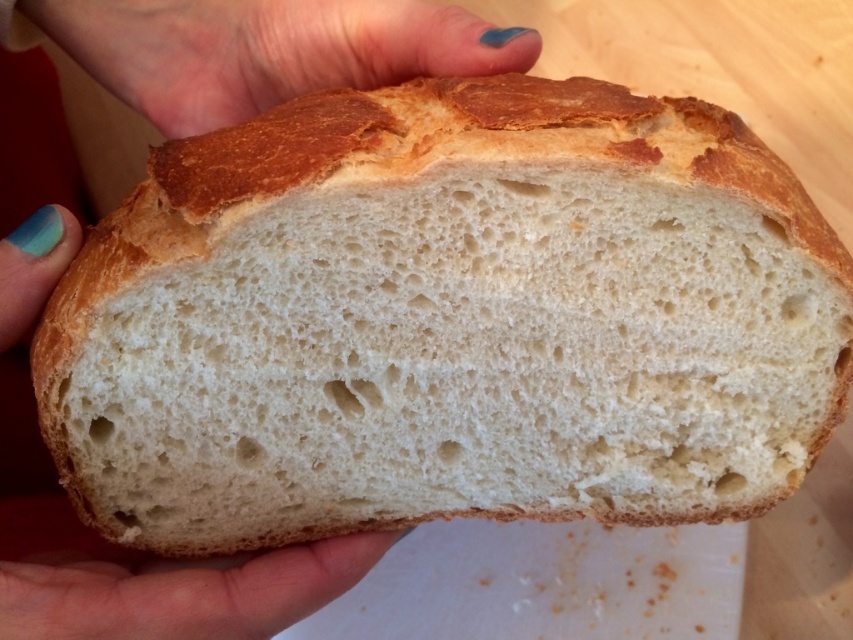
Between golden brown crusty bread at center and teal nail polish at upper center, which one has more height?

golden brown crusty bread at center is taller.

Does golden brown crusty bread at center have a lesser height compared to teal nail polish at upper center?

Incorrect, golden brown crusty bread at center's height does not fall short of teal nail polish at upper center's.

Is point (474, 220) farther from viewer compared to point (125, 16)?

No, (474, 220) is in front of (125, 16).

At what (x,y) coordinates should I click in order to perform the action: click on golden brown crusty bread at center. Please return your answer as a coordinate pair (x, y). Image resolution: width=853 pixels, height=640 pixels. Looking at the image, I should click on (445, 320).

Between golden brown crusty bread at center and teal matte nail polish at upper left, which one has less height?

teal matte nail polish at upper left is shorter.

This screenshot has height=640, width=853. Identify the location of golden brown crusty bread at center. (445, 320).

Where is `golden brown crusty bread at center`? The width and height of the screenshot is (853, 640). golden brown crusty bread at center is located at coordinates (445, 320).

Which is in front, point (390, 19) or point (202, 630)?

Point (202, 630)

Identify the location of teal nail polish at upper center. point(265,49).